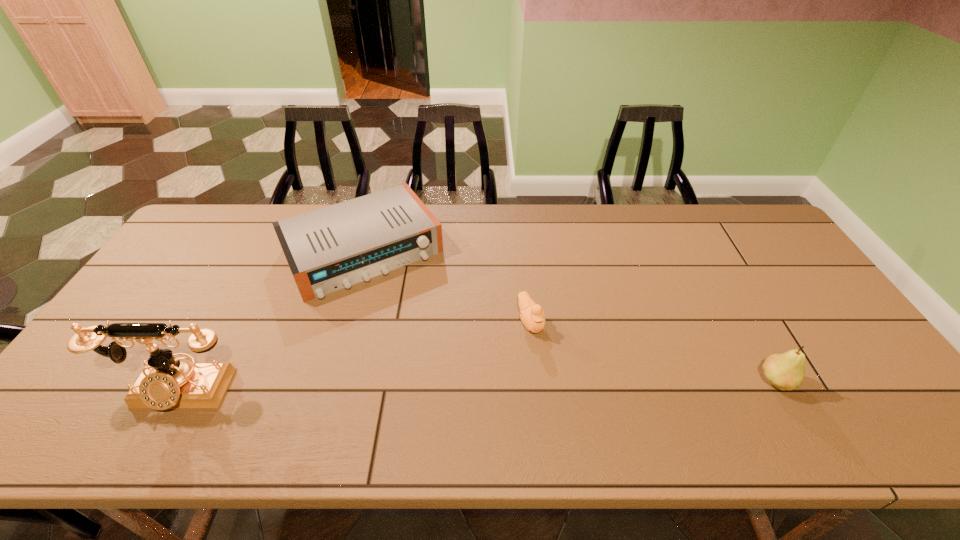
The image size is (960, 540). In the image, there is a desktop. What are the coordinates of `vacant space at the left edge` in the screenshot? It's located at (225, 251).

The image size is (960, 540). Identify the location of vacant space at the far left corner of the desktop. (190, 235).

Identify the location of vacant space at the near left corner. This screenshot has width=960, height=540. (127, 384).

Where is `vacant area that lies between the pear and the farthest object`? Image resolution: width=960 pixels, height=540 pixels. vacant area that lies between the pear and the farthest object is located at coordinates (569, 316).

I want to click on free spot between the tallest object and the third nearest object, so click(355, 357).

Where is `unoccupied area between the duckling and the radio receiver`? The height and width of the screenshot is (540, 960). unoccupied area between the duckling and the radio receiver is located at coordinates (446, 286).

This screenshot has width=960, height=540. I want to click on free spot between the rightmost object and the radio receiver, so click(569, 316).

The width and height of the screenshot is (960, 540). Identify the location of empty space that is in between the telephone and the farthest object. (272, 321).

The height and width of the screenshot is (540, 960). Identify the location of vacant area that lies between the farthest object and the second tallest object. (569, 316).

Image resolution: width=960 pixels, height=540 pixels. I want to click on empty space that is in between the radio receiver and the third nearest object, so click(x=446, y=286).